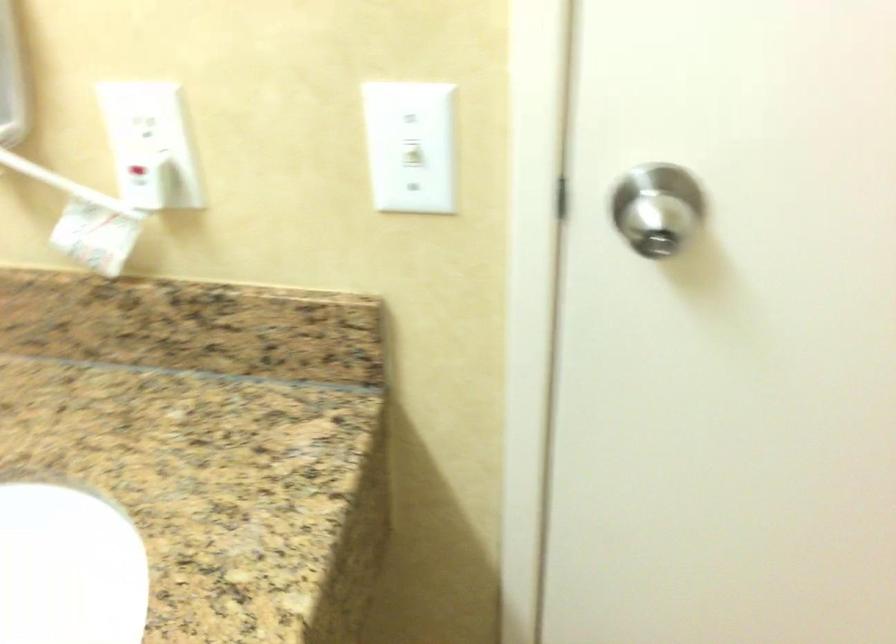
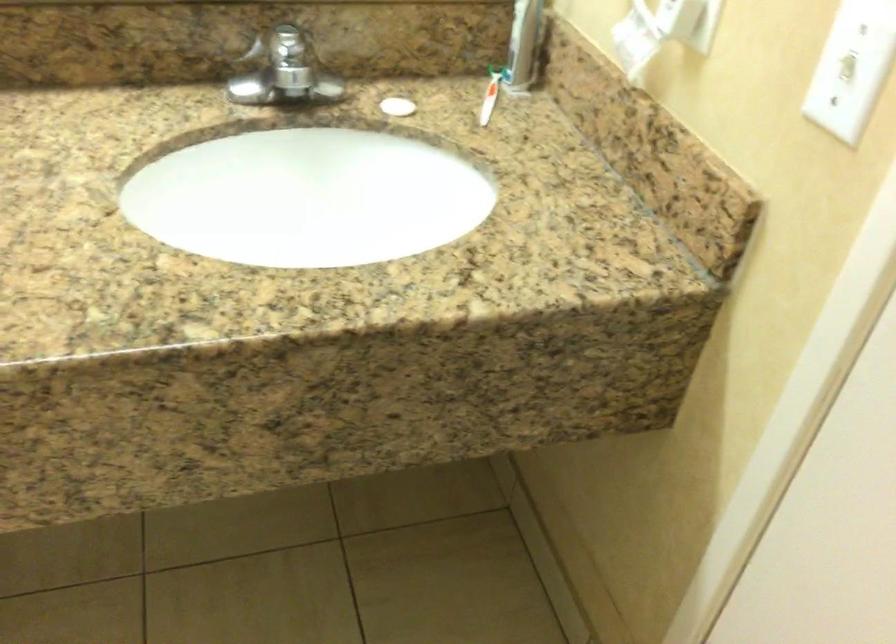
The images are taken continuously from a first-person perspective. In which direction is your viewpoint rotating?

The camera rotated toward left-down.